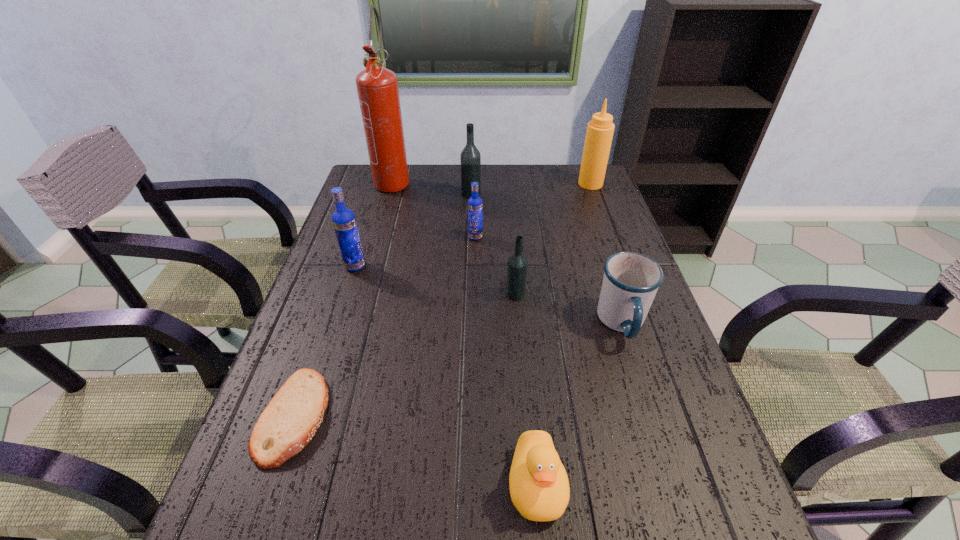
Identify the location of the smaller black vodka. This screenshot has height=540, width=960. (517, 264).

Locate an element on the screen. the right black vodka is located at coordinates (517, 264).

This screenshot has height=540, width=960. I want to click on white mug, so click(x=631, y=280).

Find the location of `duck`. duck is located at coordinates (539, 487).

Find the location of a particular element. Image resolution: width=960 pixels, height=540 pixels. yellow duck is located at coordinates [x=539, y=487].

Find the location of `pita bread`. pita bread is located at coordinates (290, 420).

Where is `free region located from the nozzle of the tallest object`? free region located from the nozzle of the tallest object is located at coordinates (380, 224).

Identify the location of free space located 0.240m on the front of the second tallest object. (608, 232).

You are a GUI agent. You are given a task and a screenshot of the screen. Output one action in this format:
    pyautogui.click(x=<x>, y=<y>)
    Task: Click on the vacant space situated on the back of the leftmost vodka
    The image size is (960, 540).
    Given the screenshot: What is the action you would take?
    pyautogui.click(x=377, y=197)

The height and width of the screenshot is (540, 960). Identify the location of free space located on the left of the farthest vodka. (370, 193).